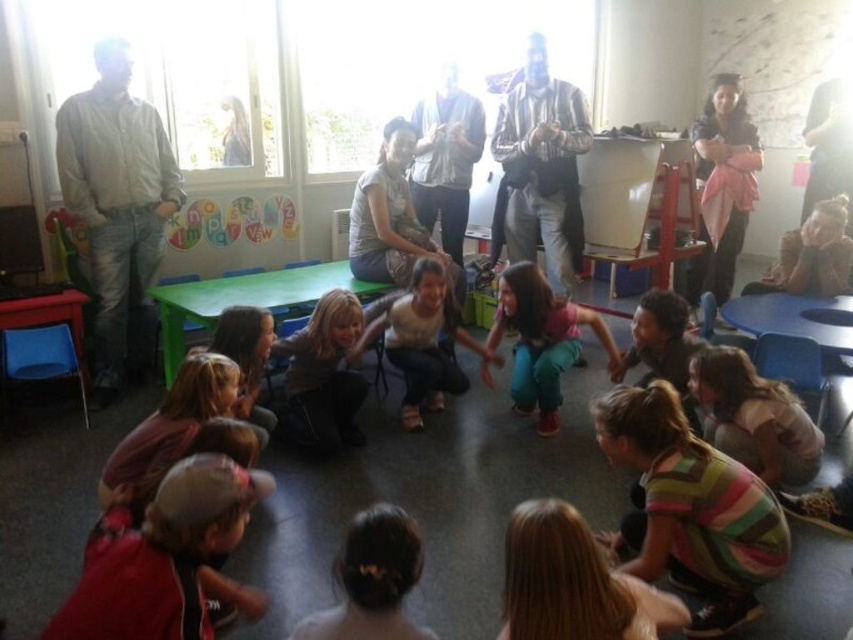
You are standing at the point marked as point (x=117, y=314) in the image. If you want to take a photo of the children and adults in the center of the group, will you be able to capture them all in your shot without moving? The camera you are using has a standard 50mm lens with a field of view of 46 degrees.

The distance between you and the camera is 3.82 meters. With a 50mm lens and a 46 degree field of view, the camera can capture a horizontal angle that includes the entire group of children and adults in the center. Therefore, you can capture them all without moving.